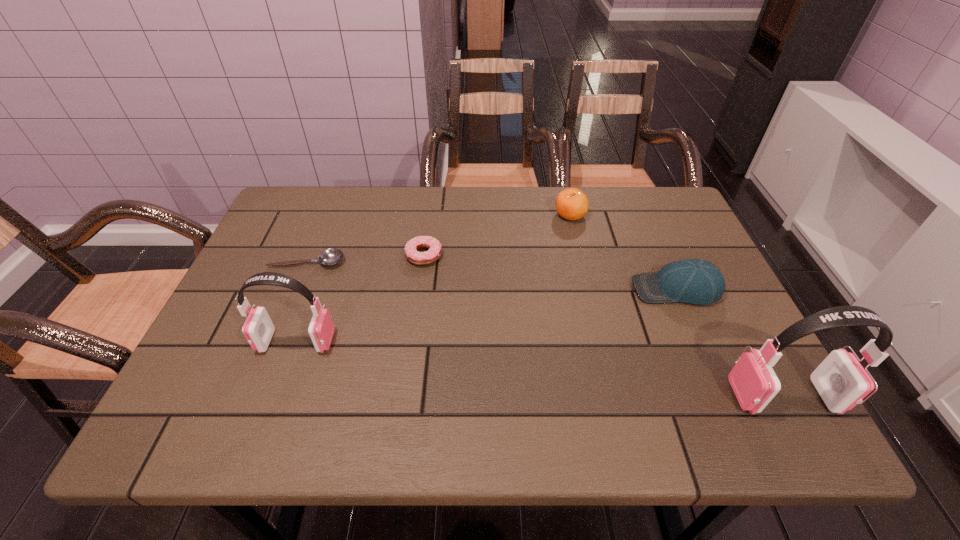
Identify the location of free space between the fourth farthest object and the fourth object from left to right. The width and height of the screenshot is (960, 540). (623, 252).

This screenshot has width=960, height=540. In order to click on vacant area between the farther earphone and the nearer earphone in this screenshot , I will do `click(540, 369)`.

Where is `free area in between the nearer earphone and the clementine`? This screenshot has width=960, height=540. free area in between the nearer earphone and the clementine is located at coordinates click(x=677, y=305).

Identify the location of free area in between the third nearest object and the ladle. (492, 275).

In order to click on free spot between the shortest object and the baseball cap in this screenshot , I will do `click(492, 275)`.

Locate an element on the screen. Image resolution: width=960 pixels, height=540 pixels. vacant space that's between the tallest object and the fourth farthest object is located at coordinates (730, 342).

Locate an element on the screen. free area in between the baseball cap and the shorter earphone is located at coordinates (486, 315).

You are a GUI agent. You are given a task and a screenshot of the screen. Output one action in this format:
    pyautogui.click(x=<x>, y=<y>)
    Task: Click on the free space that is in between the nearest object and the ladle
    The image size is (960, 540).
    Given the screenshot: What is the action you would take?
    pyautogui.click(x=545, y=329)

I want to click on unoccupied position between the doughnut and the shortest object, so click(366, 259).

Locate which object ranks fifth in proximity to the third nearest object. Please provide its 2D coordinates. Your answer should be formatted as a tuple, i.e. [(x, y)], where the tuple contains the x and y coordinates of a point satisfying the conditions above.

[(332, 256)]